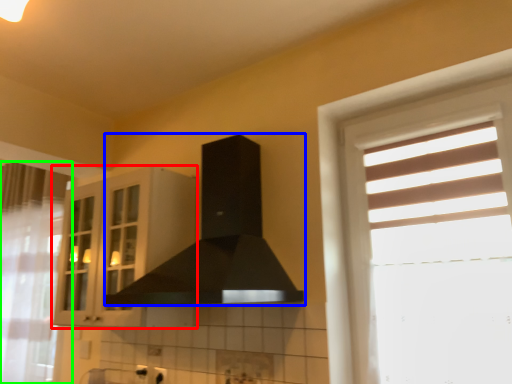
Question: Which object is the farthest from cabinetry (highlighted by a red box)? Choose among these: fume hood (highlighted by a blue box) or curtain (highlighted by a green box).

Choices:
 (A) fume hood
 (B) curtain

Answer: (B)